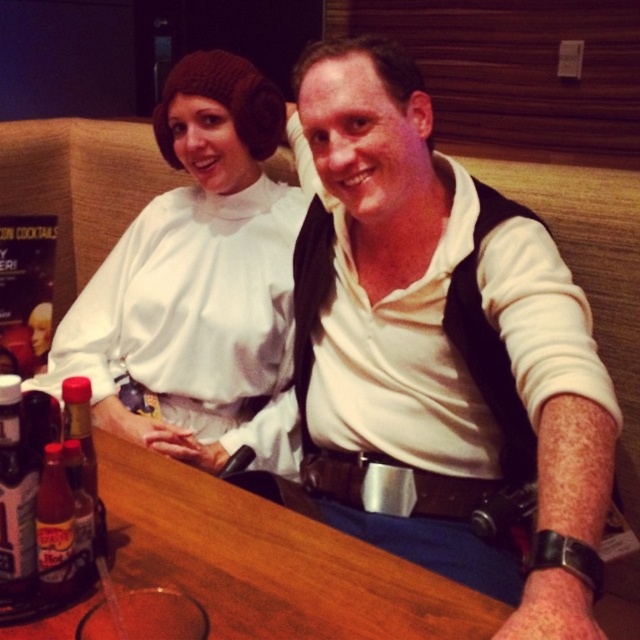
Question: Which of the following is the closest to the observer?

Choices:
 (A) (88, 529)
 (B) (70, 554)
 (C) (29, 556)

Answer: (C)

Question: Can you confirm if white matte/soft fabric dress at upper left is smaller than translucent plastic bottle at table left?

Choices:
 (A) no
 (B) yes

Answer: (A)

Question: Which object is closer to the camera taking this photo?

Choices:
 (A) translucent plastic bottle at lower left
 (B) translucent plastic bottle at table left
 (C) translucent glass bottle at center

Answer: (A)

Question: Does translucent plastic bottle at lower left appear under translucent glass bottle at center?

Choices:
 (A) yes
 (B) no

Answer: (B)

Question: Considering the relative positions of translucent plastic bottle at lower left and translucent plastic bottle at table left in the image provided, where is translucent plastic bottle at lower left located with respect to translucent plastic bottle at table left?

Choices:
 (A) below
 (B) above

Answer: (B)

Question: Which point is closer to the camera taking this photo?

Choices:
 (A) (19, 566)
 (B) (86, 557)
 (C) (134, 323)
 (D) (58, 576)

Answer: (A)